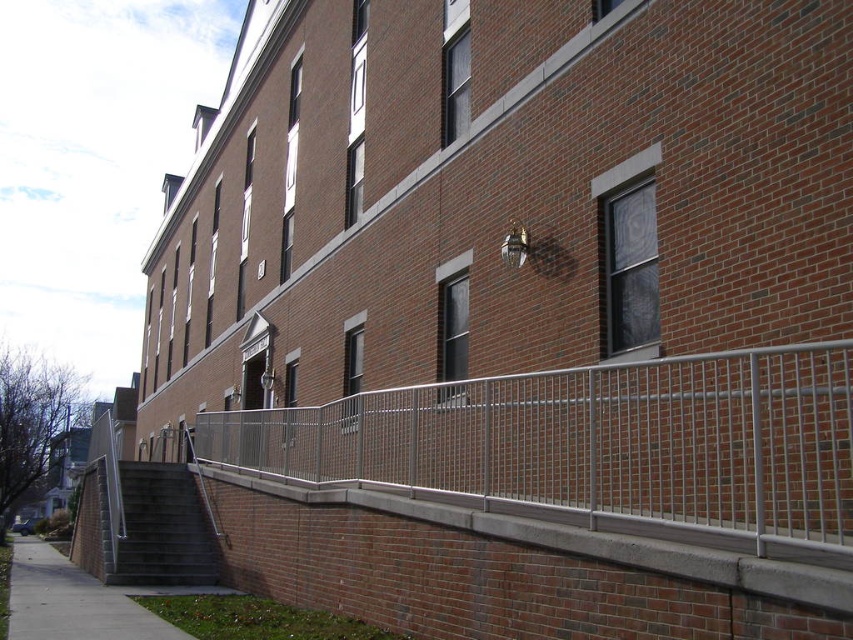
Question: Does silver metallic railing at lower center have a lesser width compared to gray concrete stairs at lower left?

Choices:
 (A) no
 (B) yes

Answer: (A)

Question: Which point is farther to the camera?

Choices:
 (A) silver metallic railing at lower center
 (B) gray concrete sidewalk at lower left
 (C) gray concrete stairs at lower left

Answer: (C)

Question: Which point is farther from the camera taking this photo?

Choices:
 (A) (177, 564)
 (B) (111, 598)

Answer: (A)

Question: Does gray concrete stairs at lower left have a larger size compared to gray concrete sidewalk at lower left?

Choices:
 (A) no
 (B) yes

Answer: (A)

Question: Can you confirm if silver metallic railing at lower center is wider than gray concrete sidewalk at lower left?

Choices:
 (A) no
 (B) yes

Answer: (A)

Question: Among these points, which one is nearest to the camera?

Choices:
 (A) (183, 500)
 (B) (364, 406)
 (C) (49, 579)

Answer: (B)